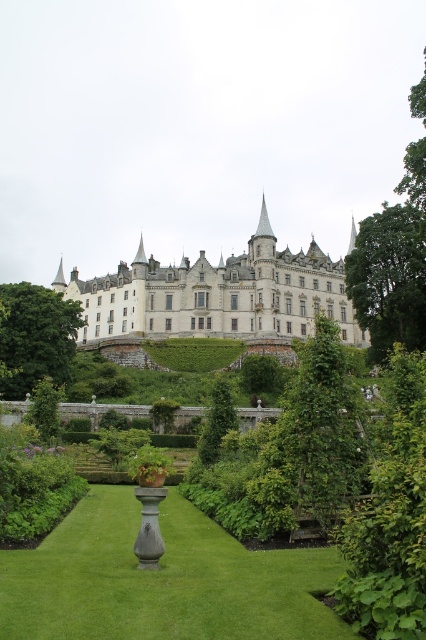
Is white stone castle at center bigger than green leafy hedge at lower left?

Correct, white stone castle at center is larger in size than green leafy hedge at lower left.

Based on the photo, does white stone castle at center lie behind green leafy hedge at lower left?

Yes, it is behind green leafy hedge at lower left.

Which is behind, point (123, 323) or point (74, 481)?

Point (123, 323)

Where is `white stone castle at center`? Image resolution: width=426 pixels, height=640 pixels. white stone castle at center is located at coordinates 216,294.

Is green leafy hedge at center thinner than green leafy hedge at lower left?

Incorrect, green leafy hedge at center's width is not less than green leafy hedge at lower left's.

Which of these two, green leafy hedge at center or green leafy hedge at lower left, stands shorter?

green leafy hedge at lower left

Measure the distance between point (69,307) and camera.

Point (69,307) and camera are 97.06 meters apart.

Identify the location of green leafy hedge at center. The height and width of the screenshot is (640, 426). [36, 337].

Does green leafy hedge at right have a greater height compared to green leafy hedge at center?

Correct, green leafy hedge at right is much taller as green leafy hedge at center.

The image size is (426, 640). What do you see at coordinates (391, 516) in the screenshot?
I see `green leafy hedge at right` at bounding box center [391, 516].

This screenshot has height=640, width=426. What do you see at coordinates (391, 516) in the screenshot?
I see `green leafy hedge at right` at bounding box center [391, 516].

Find the location of a particular element. green leafy hedge at right is located at coordinates [x=391, y=516].